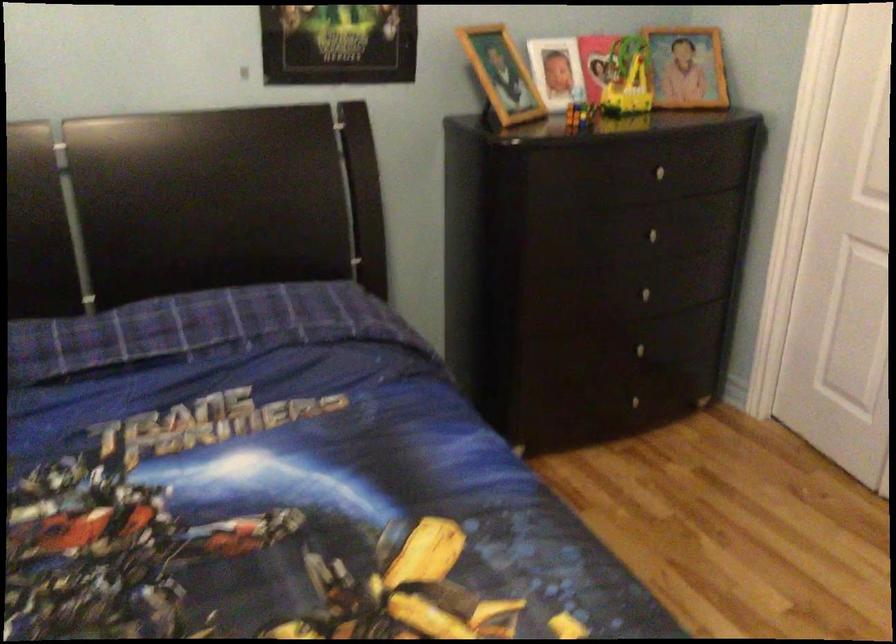
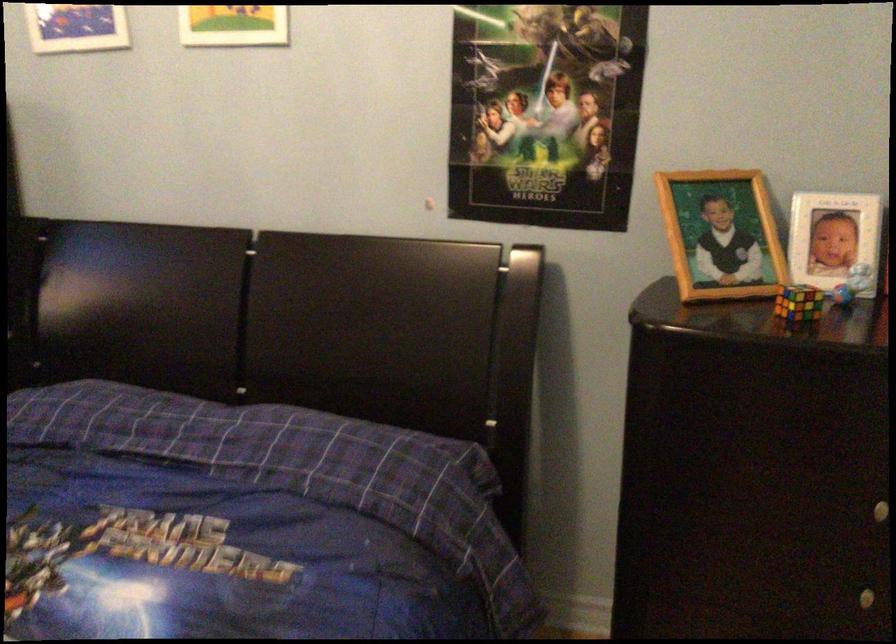
In the second image, find the point that corresponds to [500,71] in the first image.

(720, 234)